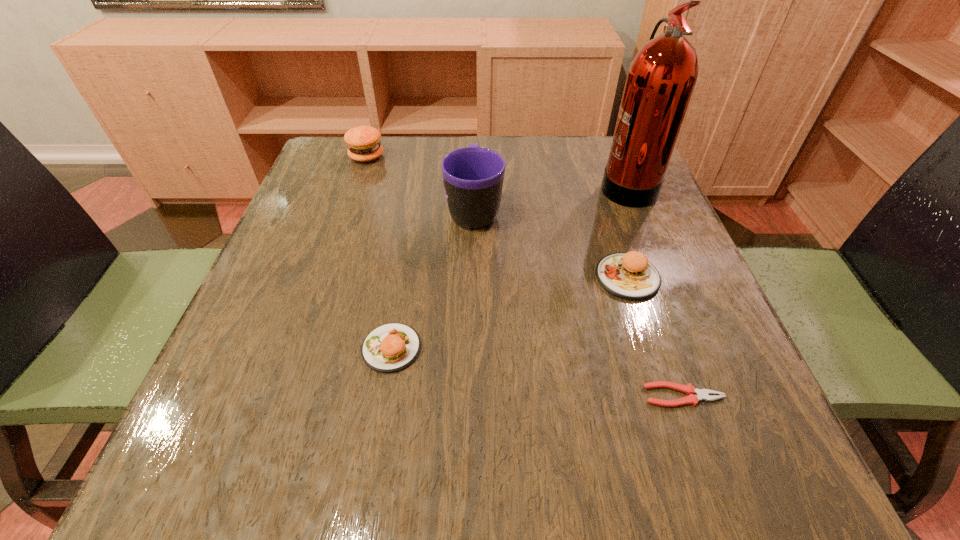
This screenshot has height=540, width=960. Find the location of `the tallest object`. the tallest object is located at coordinates (660, 81).

Where is `mug`? Image resolution: width=960 pixels, height=540 pixels. mug is located at coordinates (473, 176).

The image size is (960, 540). What are the coordinates of `the fifth shortest object` in the screenshot? It's located at (473, 176).

Where is `the third tallest object`? The image size is (960, 540). the third tallest object is located at coordinates pyautogui.click(x=363, y=142).

You are a GUI agent. You are given a task and a screenshot of the screen. Output one action in this format:
    pyautogui.click(x=<x>, y=<y>)
    Task: Click on the leftmost patty
    The image size is (960, 540).
    Given the screenshot: What is the action you would take?
    pyautogui.click(x=363, y=142)

What are the coordinates of `the third nearest object` in the screenshot? It's located at (630, 275).

You are a GUI agent. You are given a task and a screenshot of the screen. Output one action in this format:
    pyautogui.click(x=<x>, y=<y>)
    Task: Click on the second farthest patty
    
    Given the screenshot: What is the action you would take?
    pyautogui.click(x=630, y=275)

This screenshot has width=960, height=540. I want to click on the second nearest object, so click(391, 347).

At what (x,y) coordinates should I click in order to perform the action: click on the second shortest object. Please return your answer as a coordinate pair (x, y). Looking at the image, I should click on (391, 347).

Find the location of a particular element. The width and height of the screenshot is (960, 540). the shortest object is located at coordinates (701, 394).